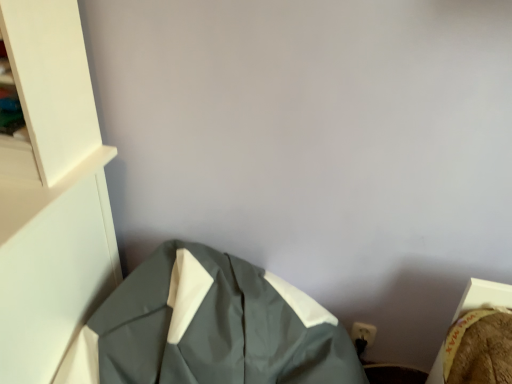
The width and height of the screenshot is (512, 384). What do you see at coordinates (209, 327) in the screenshot?
I see `dark gray fabric jacket at lower left` at bounding box center [209, 327].

At what (x,y) coordinates should I click in order to perform the action: click on dark gray fabric jacket at lower left. Please return your answer as a coordinate pair (x, y). The width and height of the screenshot is (512, 384). Looking at the image, I should click on (209, 327).

What are the coordinates of `dark gray fabric jacket at lower left` in the screenshot? It's located at (209, 327).